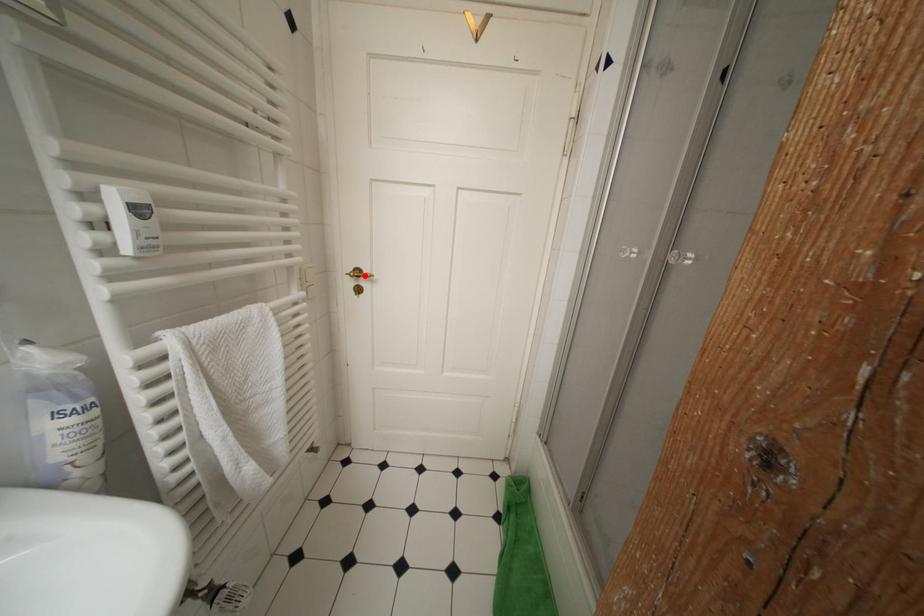
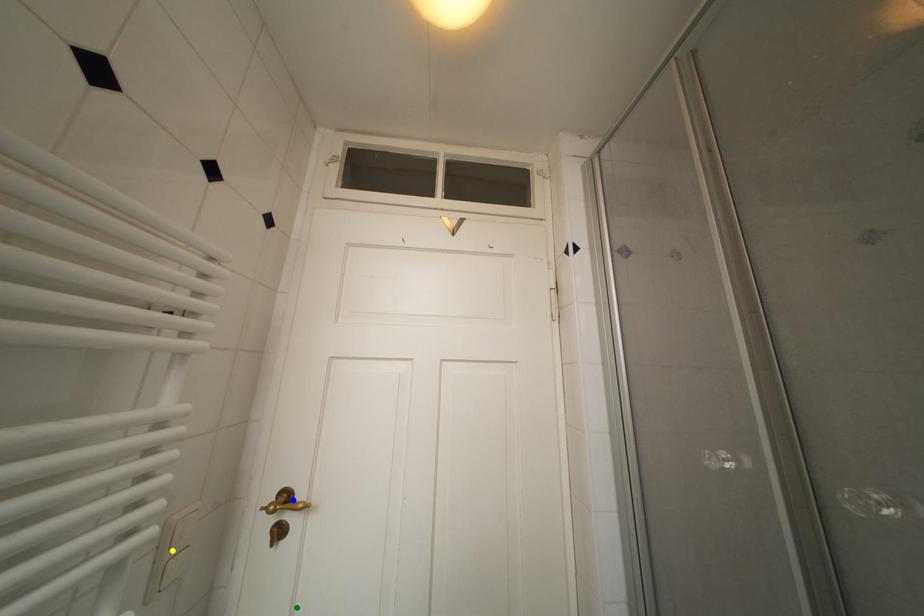
Question: I am providing you with two images of the same scene from different viewpoints. A red point is marked on the first image. You are given multiple points on the second image. In image 2, which mark is for the same physical point as the one in image 1?

Choices:
 (A) green point
 (B) blue point
 (C) yellow point

Answer: (B)